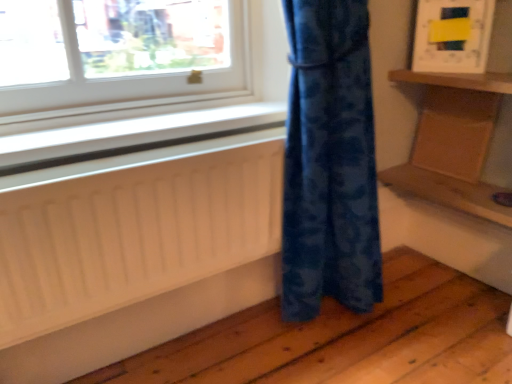
Question: Is wooden tray at right surrounded by wooden at right, the second shelf in the top-to-bottom sequence?

Choices:
 (A) yes
 (B) no

Answer: (B)

Question: Is the position of wooden at right, the first shelf when ordered from bottom to top, more distant than that of wooden tray at right?

Choices:
 (A) no
 (B) yes

Answer: (A)

Question: Considering the relative sizes of wooden at right, the second shelf in the top-to-bottom sequence, and wooden tray at right in the image provided, is wooden at right, the second shelf in the top-to-bottom sequence, wider than wooden tray at right?

Choices:
 (A) no
 (B) yes

Answer: (B)

Question: From the image's perspective, would you say wooden at right, the second shelf in the top-to-bottom sequence, is shown under wooden tray at right?

Choices:
 (A) no
 (B) yes

Answer: (B)

Question: Is wooden at right, the first shelf when ordered from bottom to top, turned away from wooden tray at right?

Choices:
 (A) no
 (B) yes

Answer: (B)

Question: Could you tell me if wooden at right, the first shelf when ordered from bottom to top, is facing wooden tray at right?

Choices:
 (A) yes
 (B) no

Answer: (B)

Question: Is white plastic window sill at lower left at the right side of wooden shelf at upper right, acting as the first shelf starting from the top?

Choices:
 (A) yes
 (B) no

Answer: (B)

Question: Is white plastic window sill at lower left in contact with wooden shelf at upper right, acting as the first shelf starting from the top?

Choices:
 (A) no
 (B) yes

Answer: (A)

Question: Can you confirm if white plastic window sill at lower left is thinner than wooden shelf at upper right, the second shelf from the bottom?

Choices:
 (A) yes
 (B) no

Answer: (A)

Question: Is white plastic window sill at lower left taller than wooden shelf at upper right, acting as the first shelf starting from the top?

Choices:
 (A) yes
 (B) no

Answer: (B)

Question: Considering the relative sizes of white plastic window sill at lower left and wooden shelf at upper right, the second shelf from the bottom, in the image provided, is white plastic window sill at lower left wider than wooden shelf at upper right, the second shelf from the bottom,?

Choices:
 (A) yes
 (B) no

Answer: (B)

Question: From the image's perspective, does white plastic window sill at lower left appear lower than wooden shelf at upper right, the second shelf from the bottom?

Choices:
 (A) no
 (B) yes

Answer: (B)

Question: Is wooden tray at right not within wooden at right, the second shelf in the top-to-bottom sequence?

Choices:
 (A) no
 (B) yes

Answer: (B)